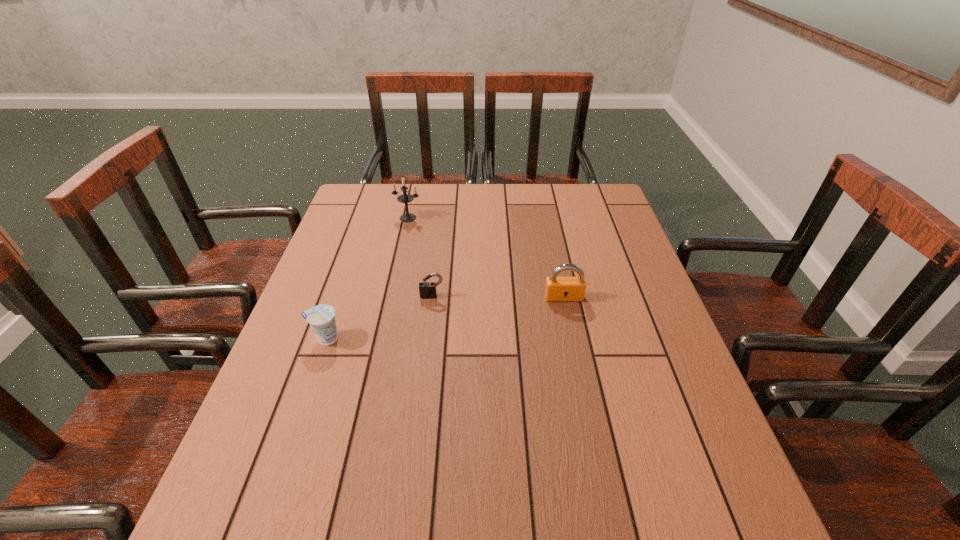
The height and width of the screenshot is (540, 960). In order to click on the third object from right to left in this screenshot , I will do `click(405, 198)`.

At what (x,y) coordinates should I click in order to perform the action: click on the tallest object. Please return your answer as a coordinate pair (x, y). This screenshot has height=540, width=960. Looking at the image, I should click on (405, 198).

You are a GUI agent. You are given a task and a screenshot of the screen. Output one action in this format:
    pyautogui.click(x=<x>, y=<y>)
    Task: Click on the second tallest object
    
    Given the screenshot: What is the action you would take?
    pyautogui.click(x=557, y=288)

Image resolution: width=960 pixels, height=540 pixels. I want to click on the rightmost object, so click(x=557, y=288).

Locate an element on the screen. yogurt is located at coordinates (321, 318).

At what (x,y) coordinates should I click in order to perform the action: click on the leftmost object. Please return your answer as a coordinate pair (x, y). Image resolution: width=960 pixels, height=540 pixels. Looking at the image, I should click on (321, 318).

I want to click on the second object from right to left, so click(x=427, y=290).

The height and width of the screenshot is (540, 960). What are the coordinates of `the shorter padlock` in the screenshot? It's located at (427, 290).

Find the location of a particular element. This screenshot has width=960, height=540. vacant space located 0.150m on the front of the candle holder is located at coordinates (400, 251).

This screenshot has width=960, height=540. Identify the location of vacant space located to unlock the third shortest object from the front. (571, 334).